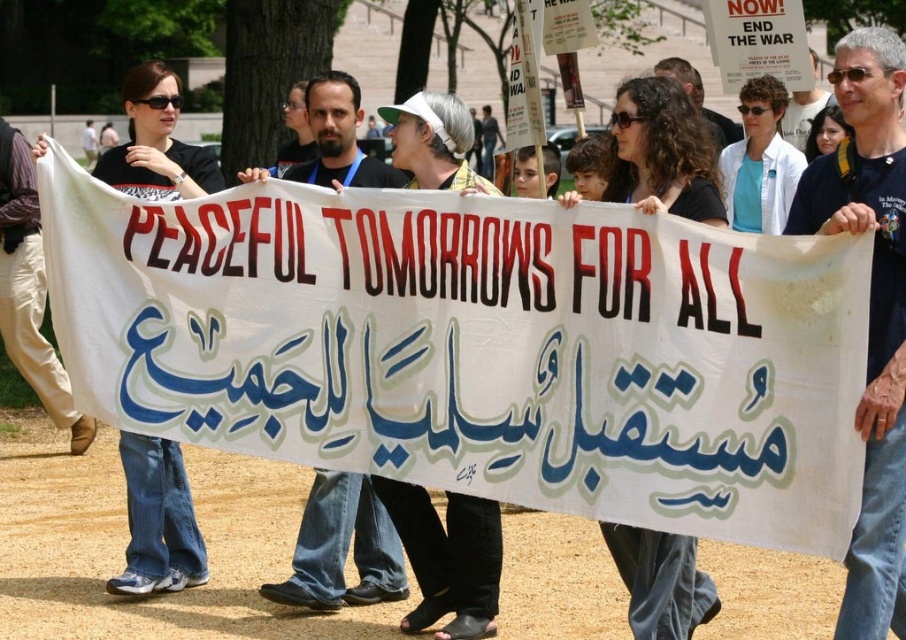
Question: Estimate the real-world distances between objects in this image. Which object is closer to the dark blue t-shirt at center?

Choices:
 (A) gray hair at center
 (B) matte black shirt at upper right

Answer: (B)

Question: Is gray hair at center bigger than matte black shirt at upper right?

Choices:
 (A) no
 (B) yes

Answer: (A)

Question: Estimate the real-world distances between objects in this image. Which object is closer to the dark blue jeans at center?

Choices:
 (A) dark blue t-shirt at center
 (B) matte black shirt at upper right

Answer: (A)

Question: Observing the image, what is the correct spatial positioning of dark blue t-shirt at center in reference to dark blue jeans at center?

Choices:
 (A) above
 (B) below

Answer: (A)

Question: Based on their relative distances, which object is farther from the matte black shirt at upper right?

Choices:
 (A) dark blue t-shirt at center
 (B) dark blue jeans at center
 (C) gray hair at center

Answer: (A)

Question: Can you confirm if dark blue t-shirt at center is thinner than matte black shirt at upper right?

Choices:
 (A) yes
 (B) no

Answer: (A)